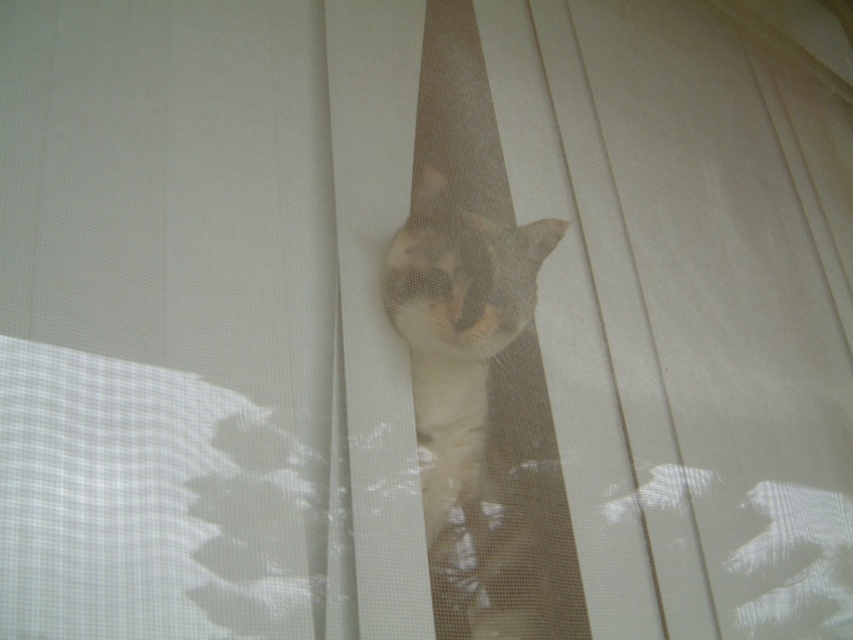
Can you confirm if white sheer curtain at center is positioned to the right of light brown fur cat at center?

No, white sheer curtain at center is not to the right of light brown fur cat at center.

Does point (223, 99) come behind point (495, 403)?

No, (223, 99) is in front of (495, 403).

You are a GUI agent. You are given a task and a screenshot of the screen. Output one action in this format:
    pyautogui.click(x=<x>, y=<y>)
    Task: Click on the white sheer curtain at center
    This screenshot has height=640, width=853.
    Given the screenshot: What is the action you would take?
    pyautogui.click(x=165, y=321)